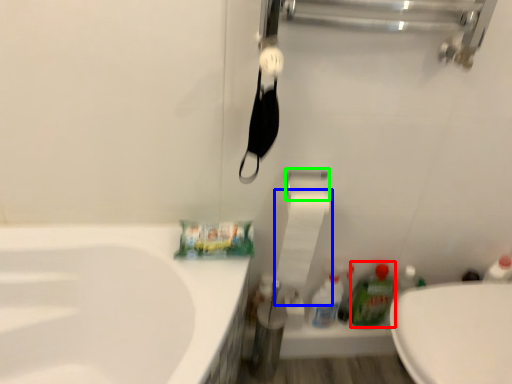
Question: Based on their relative distances, which object is farther from cleaning product (highlighted by a red box)? Choose from toilet paper (highlighted by a blue box) and towel bar (highlighted by a green box).

Choices:
 (A) toilet paper
 (B) towel bar

Answer: (B)